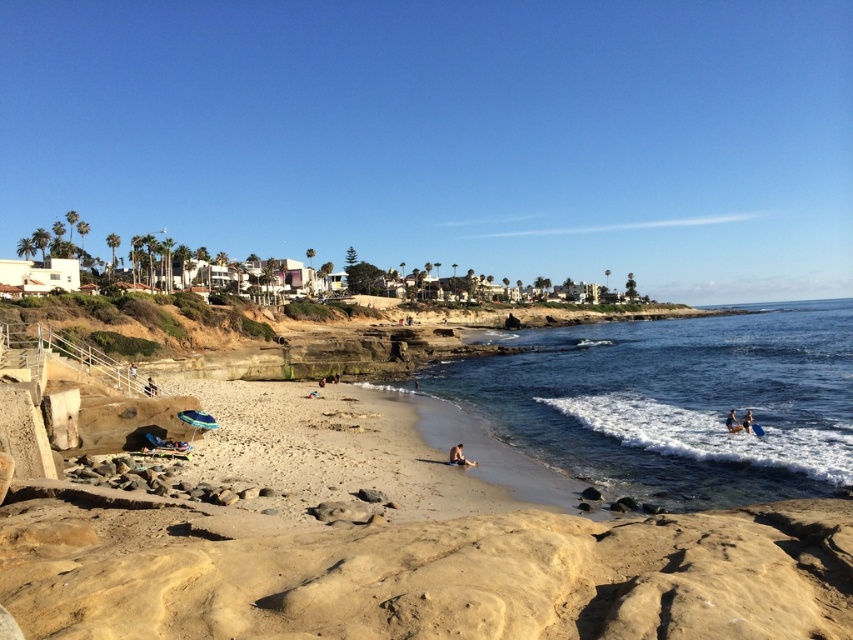
Can you confirm if smooth tan skin at lower right is bigger than blue fabric surfboard at lower right?

No, smooth tan skin at lower right is not bigger than blue fabric surfboard at lower right.

Can you confirm if smooth tan skin at lower right is thinner than blue fabric surfboard at lower right?

Indeed, smooth tan skin at lower right has a lesser width compared to blue fabric surfboard at lower right.

Is point (734, 422) behind point (746, 420)?

Yes, point (734, 422) is behind point (746, 420).

Image resolution: width=853 pixels, height=640 pixels. What are the coordinates of `smooth tan skin at lower right` in the screenshot? It's located at (732, 422).

Can you confirm if light brown sandy beach at center is positioned to the right of light brown wooden chair at lower left?

Indeed, light brown sandy beach at center is positioned on the right side of light brown wooden chair at lower left.

Does light brown sandy beach at center come behind light brown wooden chair at lower left?

No, it is in front of light brown wooden chair at lower left.

Between point (389, 486) and point (135, 365), which one is positioned in front?

Point (389, 486) is in front.

This screenshot has height=640, width=853. In order to click on light brown sandy beach at center in this screenshot , I will do `click(332, 452)`.

Is point (469, 461) positioned behind point (132, 378)?

No, it is in front of (132, 378).

Where is `light brown sand at lower center`? light brown sand at lower center is located at coordinates (459, 456).